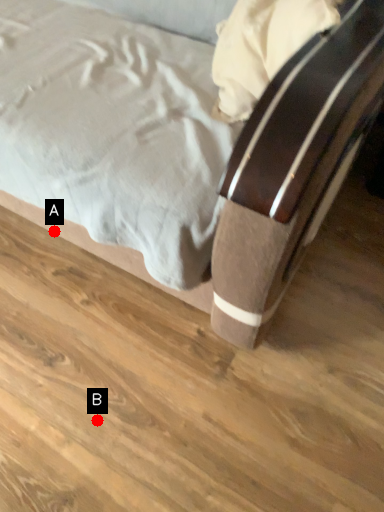
Question: Two points are circled on the image, labeled by A and B beside each circle. Which point is closer to the camera taking this photo?

Choices:
 (A) A is closer
 (B) B is closer

Answer: (B)